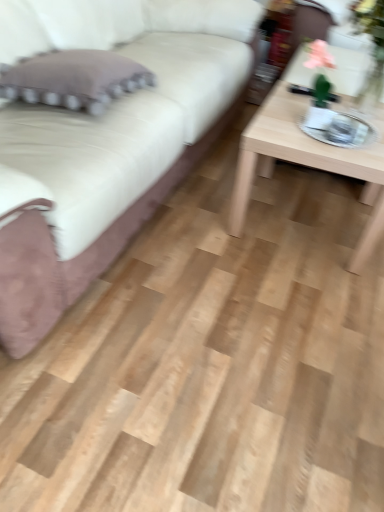
Identify the location of blank space situated above light wood/texture coffee table at right (from a real-world perspective). The width and height of the screenshot is (384, 512). (331, 126).